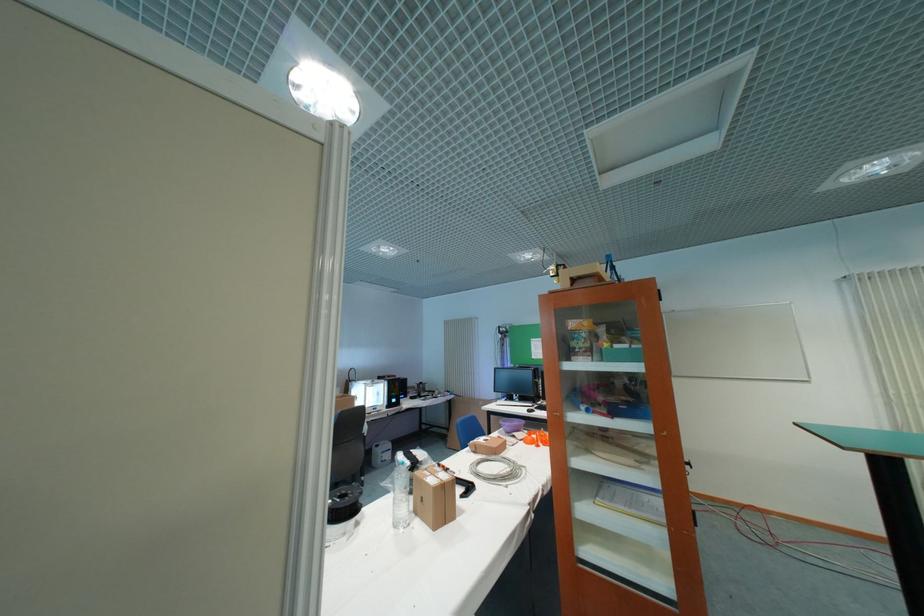
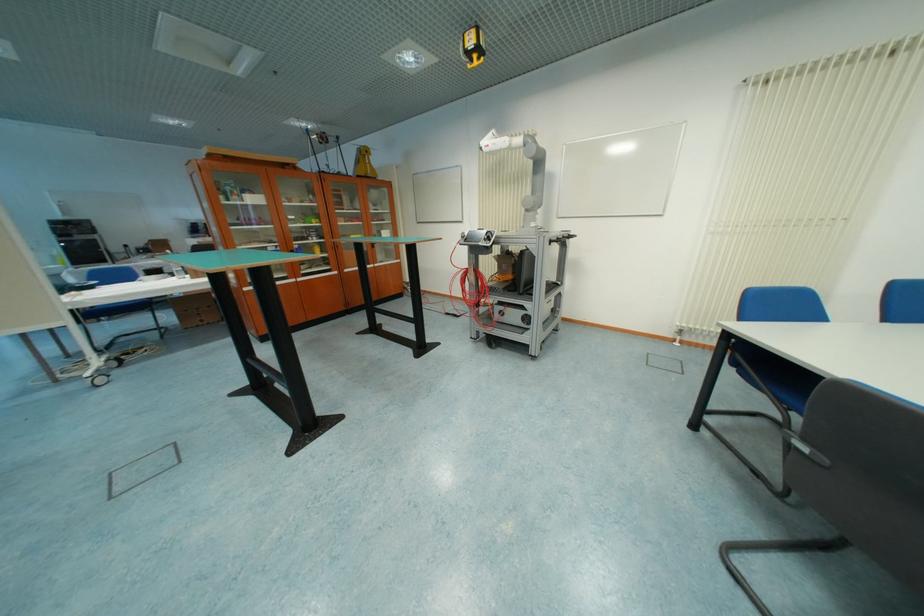
In a continuous first-person perspective shot, in which direction is the camera moving?

The cameraman walked toward right, backward.